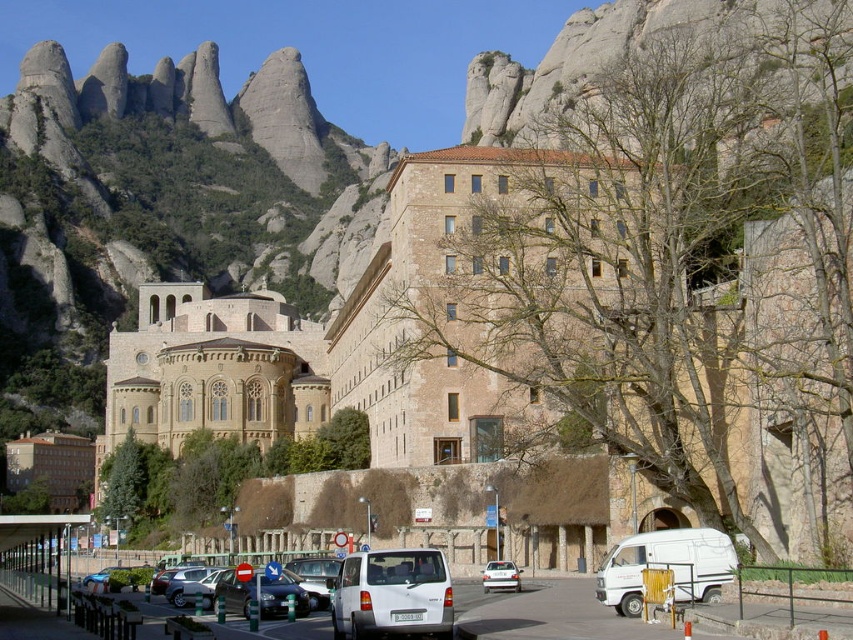
From the picture: Does white matte van at lower right lie behind white matte sedan at center?

That is False.

Is point (606, 576) positioned in front of point (514, 580)?

Yes.

Who is more forward, (x=671, y=557) or (x=498, y=588)?

Point (x=671, y=557)

Identify the location of white matte van at lower right. The height and width of the screenshot is (640, 853). (666, 566).

Which of these two, white matte van at center or white matte van at lower right, stands shorter?

white matte van at lower right

This screenshot has width=853, height=640. Find the location of `white matte van at center`. white matte van at center is located at coordinates (392, 595).

Image resolution: width=853 pixels, height=640 pixels. What are the coordinates of `white matte van at center` in the screenshot? It's located at (392, 595).

Is the position of white matte van at lower right less distant than that of metallic silver car at lower left?

Yes, white matte van at lower right is in front of metallic silver car at lower left.

Is point (618, 600) behind point (189, 596)?

No, it is in front of (189, 596).

Identify the location of white matte van at lower right. The width and height of the screenshot is (853, 640). (666, 566).